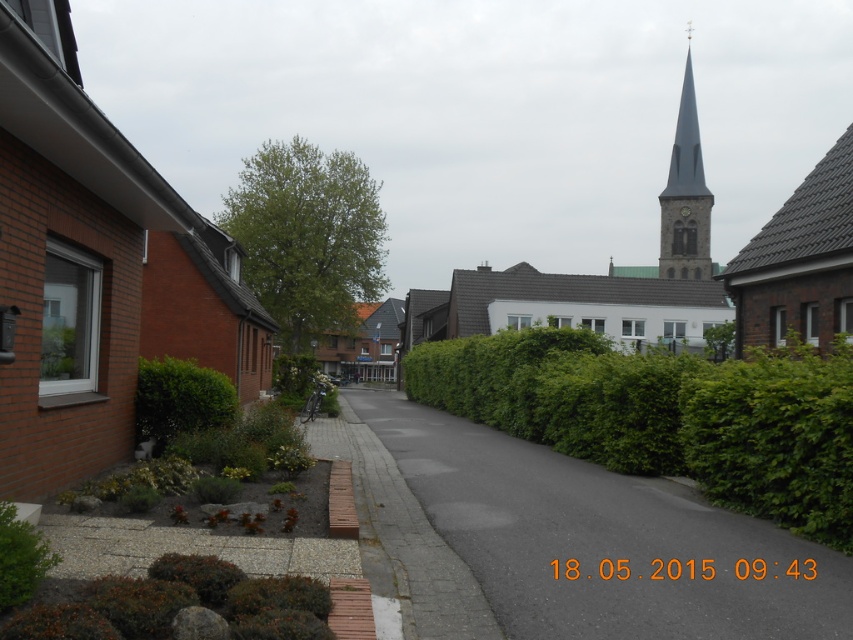
You are walking along the residential street and want to step onto the asphalt at center. Which direction should you move relative to the green leafy hedge at center?

To step onto the asphalt at center, you should move to the left of the green leafy hedge at center since the asphalt at center is located to its left.

You are standing on the residential street and want to take a photo. There are two points marked in the scene, point 1 at coordinates (701, 609) and point 2 at coordinates (165, 356). Which point will appear larger in your photo?

Point 1 at coordinates (701, 609) will appear larger in the photo because it is closer to the camera than point 2 at coordinates (165, 356).

You are a delivery person trying to park your bike on the asphalt at center. The green leafy hedge at lower left is in the way. Can you fit your bike there without hitting the hedge?

The asphalt at center has a larger size compared to green leafy hedge at lower left, so yes, you can fit your bike there without hitting the hedge since the asphalt area is bigger than the hedge.